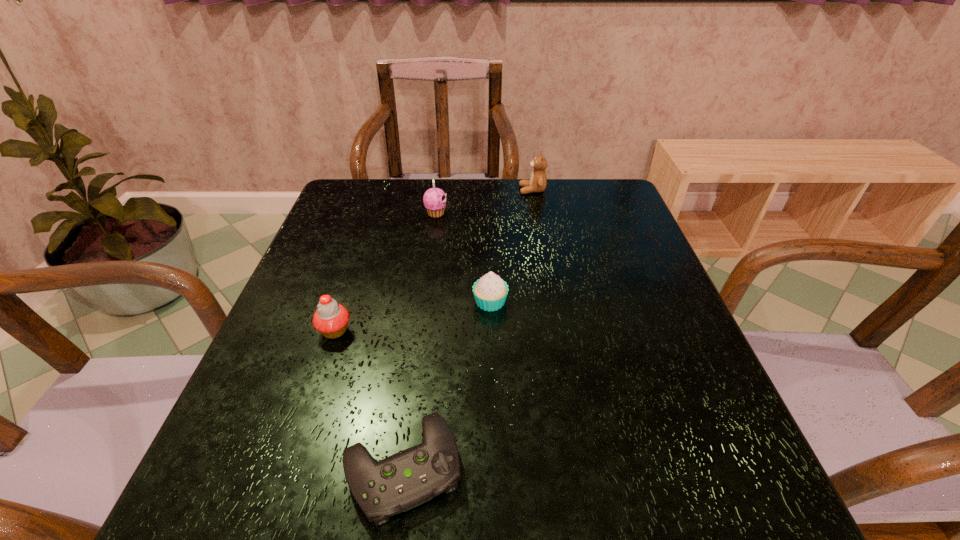
Where is `the rightmost object`? the rightmost object is located at coordinates (537, 183).

At what (x,y) coordinates should I click in order to perform the action: click on teddy bear. Please return your answer as a coordinate pair (x, y). This screenshot has height=540, width=960. Looking at the image, I should click on (537, 183).

This screenshot has height=540, width=960. Identify the location of the second cupcake from right to left. (434, 199).

You are a GUI agent. You are given a task and a screenshot of the screen. Output one action in this format:
    pyautogui.click(x=<x>, y=<y>)
    Task: Click on the fourth nearest object
    This screenshot has width=960, height=540.
    Given the screenshot: What is the action you would take?
    pyautogui.click(x=434, y=199)

Image resolution: width=960 pixels, height=540 pixels. Identify the location of the second nearest object. (331, 319).

I want to click on the leftmost object, so click(x=331, y=319).

Find the location of a particular element. the second object from right to left is located at coordinates (490, 292).

Image resolution: width=960 pixels, height=540 pixels. Identify the location of the second nearest cupcake. (490, 292).

Find the location of a particular element. Image resolution: width=960 pixels, height=540 pixels. the shortest object is located at coordinates (409, 478).

Image resolution: width=960 pixels, height=540 pixels. In order to click on the nearest object in this screenshot , I will do `click(409, 478)`.